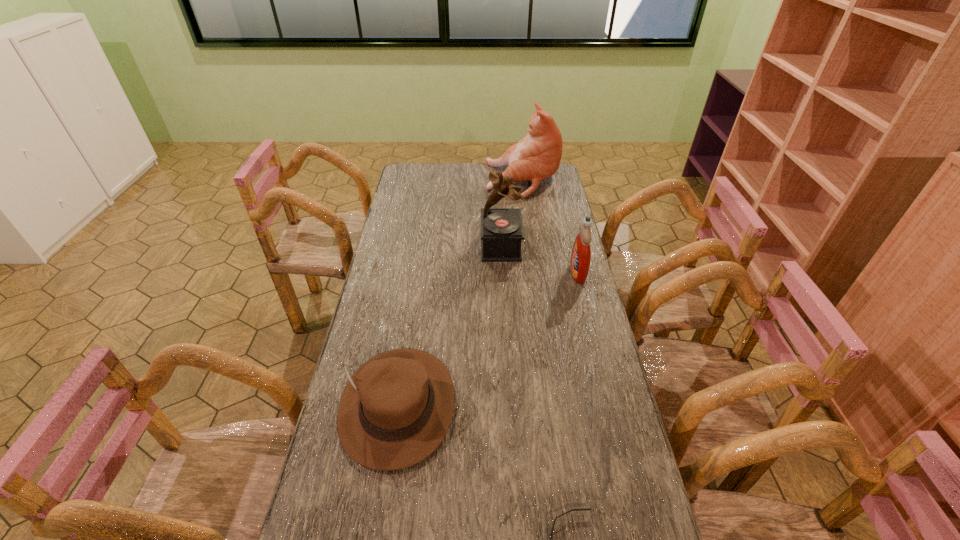
At what (x,y) coordinates should I click in order to perform the action: click on vacant space situated at the horn opening of the phonograph_record. Please return your answer as a coordinate pair (x, y). This screenshot has height=540, width=960. Looking at the image, I should click on (395, 246).

I want to click on vacant position located 0.130m on the front surface of the detergent, so click(x=535, y=272).

Where is `vacant space situated 0.130m on the front surface of the detergent`? Image resolution: width=960 pixels, height=540 pixels. vacant space situated 0.130m on the front surface of the detergent is located at coordinates (535, 272).

In order to click on vacant space located on the front surface of the detergent in this screenshot , I will do `click(499, 272)`.

The width and height of the screenshot is (960, 540). I want to click on free space located 0.070m on the feather side of the fedora, so click(383, 503).

Find the location of a particular element. The height and width of the screenshot is (540, 960). object located at the far edge is located at coordinates (536, 157).

In order to click on object that is at the left edge in this screenshot , I will do `click(396, 409)`.

Find the location of a particular element. Image resolution: width=960 pixels, height=540 pixels. cat present at the right edge is located at coordinates (536, 157).

Identify the location of detergent at the right edge. (580, 259).

Image resolution: width=960 pixels, height=540 pixels. Find the location of `object at the far right corner`. object at the far right corner is located at coordinates pyautogui.click(x=536, y=157).